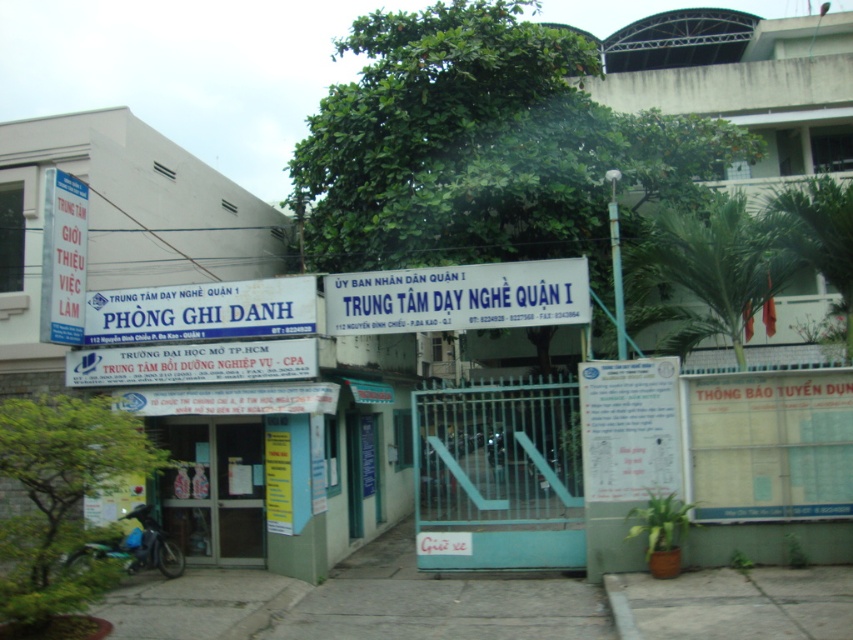
Does white paperboard at center appear over white matte sign at center?

Incorrect, white paperboard at center is not positioned above white matte sign at center.

Can you confirm if white paperboard at center is positioned to the right of white matte sign at center?

Indeed, white paperboard at center is positioned on the right side of white matte sign at center.

Identify the location of white paperboard at center. The height and width of the screenshot is (640, 853). (769, 444).

Can you confirm if gray concrete pavement at center is positioned to the right of gray concrete pavement at lower center?

In fact, gray concrete pavement at center is to the left of gray concrete pavement at lower center.

Image resolution: width=853 pixels, height=640 pixels. I want to click on gray concrete pavement at center, so click(445, 609).

Can you confirm if white paperboard at center is thinner than white plastic sign at center?

Indeed, white paperboard at center has a lesser width compared to white plastic sign at center.

Does white paperboard at center have a greater height compared to white plastic sign at center?

Yes.

Where is `white paperboard at center`? The height and width of the screenshot is (640, 853). white paperboard at center is located at coordinates (769, 444).